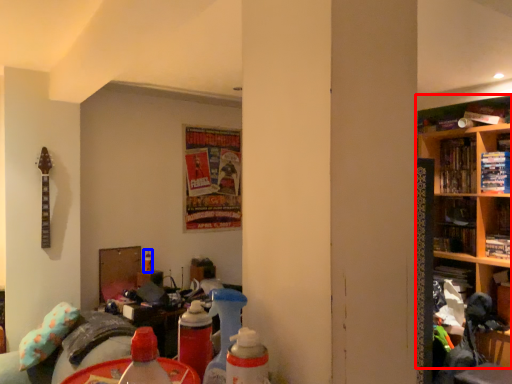
Question: Which point is further to the camera, shelf (highlighted by a red box) or bottle (highlighted by a blue box)?

Choices:
 (A) shelf
 (B) bottle

Answer: (B)